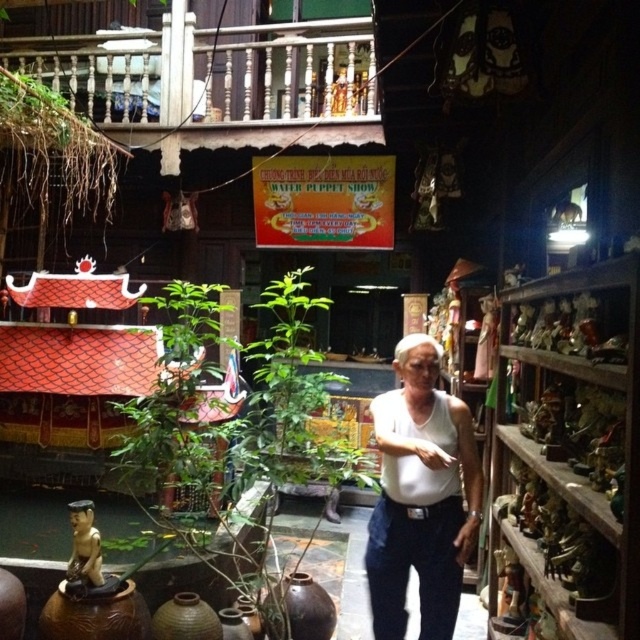
Question: Which point appears farthest from the camera in this image?

Choices:
 (A) (122, 468)
 (B) (420, 380)

Answer: (A)

Question: Can you confirm if green leafy plant at center is bigger than white cotton tank top at center?

Choices:
 (A) no
 (B) yes

Answer: (B)

Question: Is green leafy plant at center positioned in front of white cotton tank top at center?

Choices:
 (A) no
 (B) yes

Answer: (A)

Question: Does green leafy plant at center lie in front of white cotton tank top at center?

Choices:
 (A) yes
 (B) no

Answer: (B)